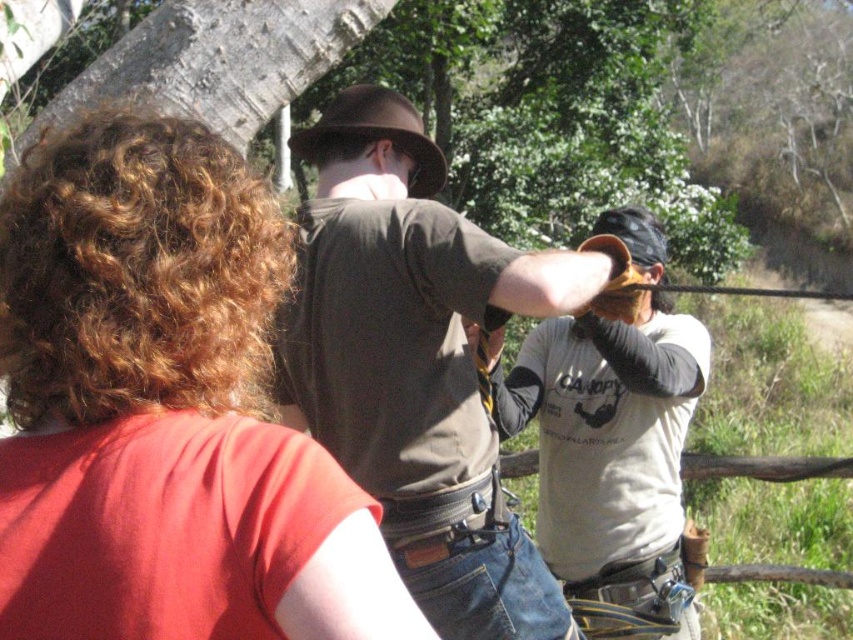
Between point (296, 400) and point (624, 512), which one is positioned behind?

Positioned behind is point (624, 512).

Who is more forward, (370, 195) or (674, 460)?

Point (370, 195) is more forward.

Is point (438, 236) positioned after point (587, 390)?

That is False.

The image size is (853, 640). What are the coordinates of `matte brown shirt at center` in the screenshot? It's located at (416, 362).

Locate an element on the screen. This screenshot has height=640, width=853. matte red shirt at upper left is located at coordinates (164, 410).

Can you confirm if matte red shirt at upper left is shorter than matte brown shirt at center?

Correct, matte red shirt at upper left is not as tall as matte brown shirt at center.

Where is `matte red shirt at upper left`? matte red shirt at upper left is located at coordinates (164, 410).

At what (x,y) coordinates should I click in order to perform the action: click on matte red shirt at upper left. Please return your answer as a coordinate pair (x, y). This screenshot has height=640, width=853. Looking at the image, I should click on (164, 410).

Is matte red shirt at upper left positioned at the back of white cotton shirt at center?

No.

Which of these two, matte red shirt at upper left or white cotton shirt at center, stands taller?

With more height is white cotton shirt at center.

Does point (190, 368) come farther from viewer compared to point (524, 364)?

That is False.

The height and width of the screenshot is (640, 853). In order to click on matte red shirt at upper left in this screenshot , I will do `click(164, 410)`.